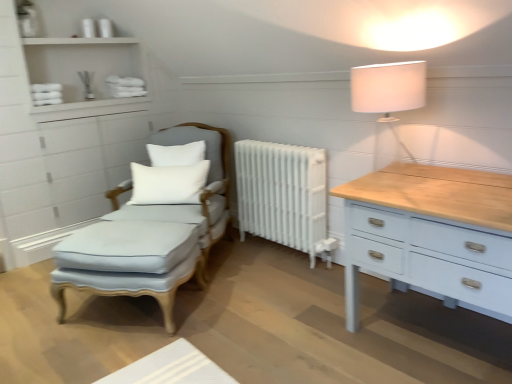
Locate an element on the screen. The height and width of the screenshot is (384, 512). vacant space in between light blue fabric swivel chair at center-left and white painted radiator at center is located at coordinates (259, 266).